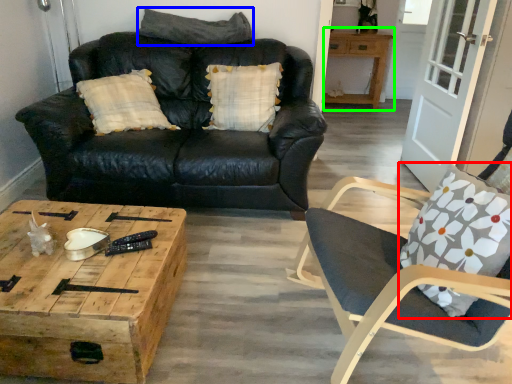
Question: Which object is positioned closest to throw pillow (highlighted by a red box)? Select from pillow (highlighted by a blue box) and table (highlighted by a green box).

Choices:
 (A) pillow
 (B) table

Answer: (A)